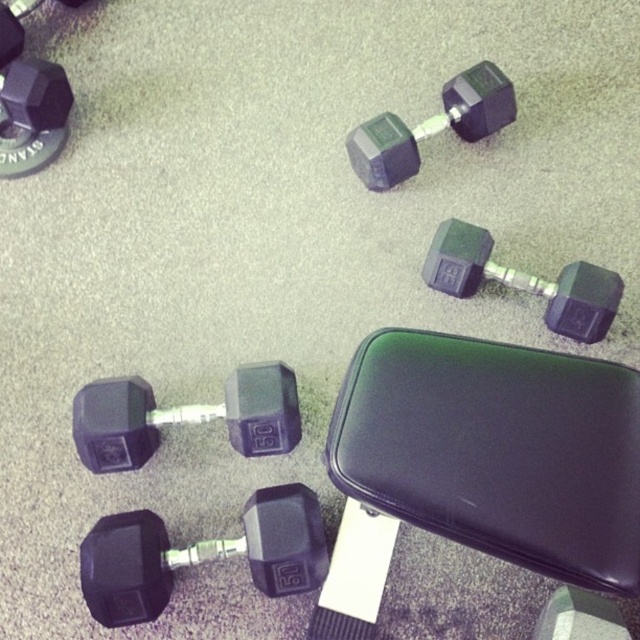
Question: Among these objects, which one is farthest from the camera?

Choices:
 (A) matte black dumbbell at upper left
 (B) rubberized black dumbbell at upper center
 (C) rubberized black dumbbell at lower left
 (D) matte black dumbbell at center right

Answer: (B)

Question: Which object is the closest to the rubberized black dumbbell at lower left?

Choices:
 (A) rubberized black dumbbell at lower center
 (B) rubberized black dumbbell at upper center
 (C) matte black dumbbell at upper left

Answer: (A)

Question: In this image, where is rubberized black dumbbell at lower center located relative to matte black dumbbell at center right?

Choices:
 (A) below
 (B) above

Answer: (A)

Question: Is matte black dumbbell at center right above matte black dumbbell at upper left?

Choices:
 (A) yes
 (B) no

Answer: (B)

Question: Among these points, which one is farthest from the camera?

Choices:
 (A) (442, 234)
 (B) (33, 125)
 (C) (460, 90)

Answer: (C)

Question: Does rubberized black dumbbell at lower center have a larger size compared to matte black dumbbell at upper left?

Choices:
 (A) no
 (B) yes

Answer: (B)